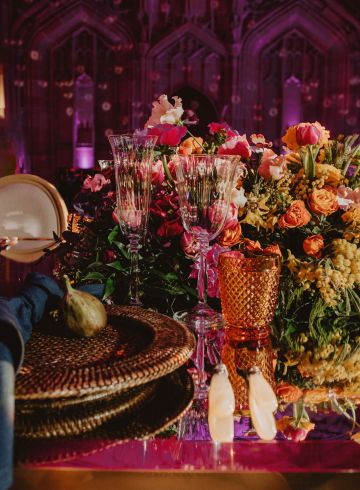
Where is `fake fig`? This screenshot has height=490, width=360. fake fig is located at coordinates (82, 314).